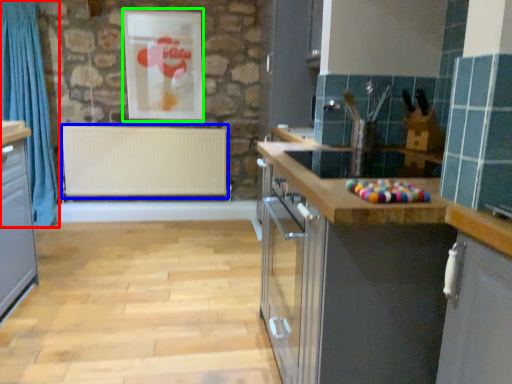
Question: Estimate the real-world distances between objects in this image. Which object is farther from curtain (highlighted by a red box), radiator (highlighted by a blue box) or picture frame (highlighted by a green box)?

Choices:
 (A) radiator
 (B) picture frame

Answer: (B)